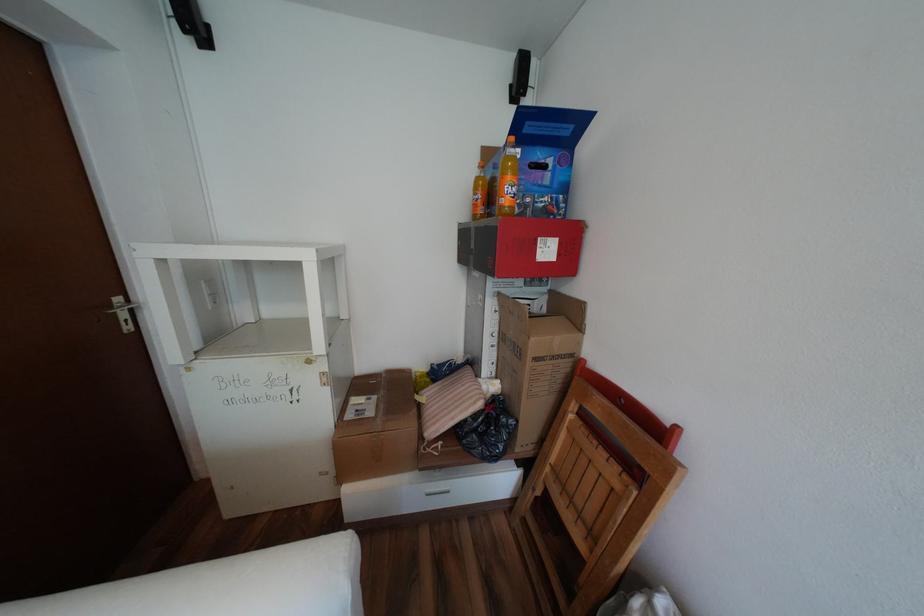
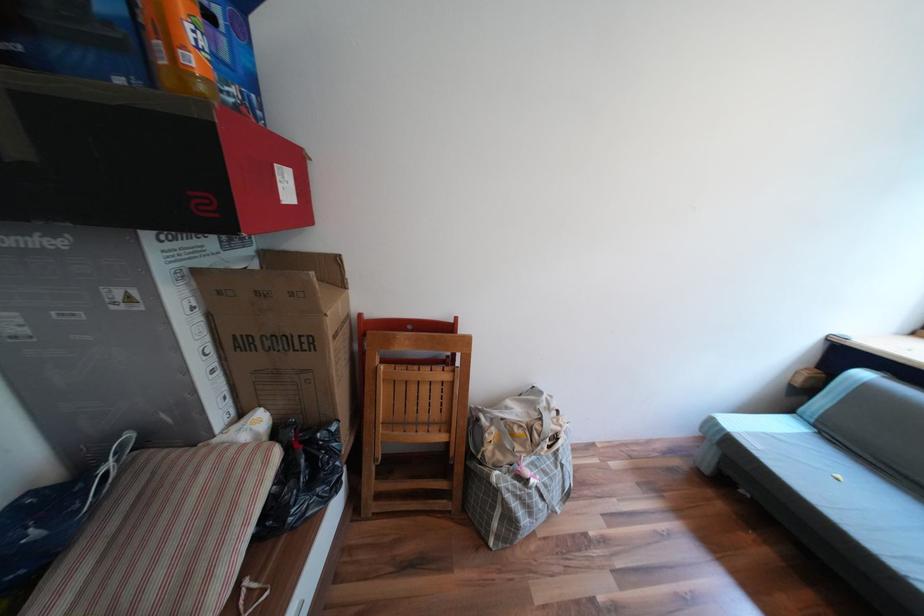
Find the pixel in the second image that matches pixel 505 334 in the first image.

(219, 349)